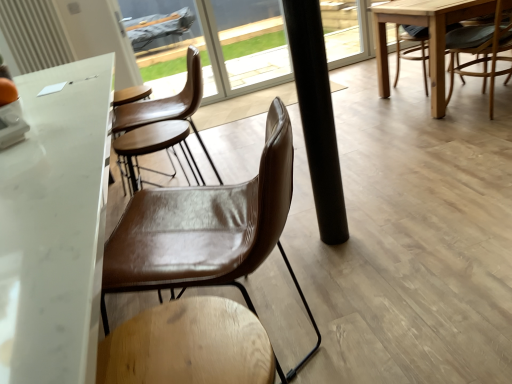
Question: Considering the positions of black matte pole at center and brown leather chair at right, which appears as the first chair when viewed from the back, in the image, is black matte pole at center taller or shorter than brown leather chair at right, which appears as the first chair when viewed from the back,?

Choices:
 (A) short
 (B) tall

Answer: (B)

Question: From the image's perspective, relative to brown leather chair at right, acting as the second chair starting from the bottom, is black matte pole at center above or below?

Choices:
 (A) below
 (B) above

Answer: (A)

Question: Estimate the real-world distances between objects in this image. Which object is closer to the black matte pole at center?

Choices:
 (A) white marble table at center
 (B) brown leather chair at center, the 1th chair positioned from the bottom
 (C) brown leather chair at right, placed as the 1th chair when sorted from top to bottom

Answer: (B)

Question: Considering the real-world distances, which object is farthest from the black matte pole at center?

Choices:
 (A) brown leather chair at center, the 2th chair viewed from the right
 (B) white marble table at center
 (C) brown leather chair at right, acting as the second chair starting from the bottom

Answer: (C)